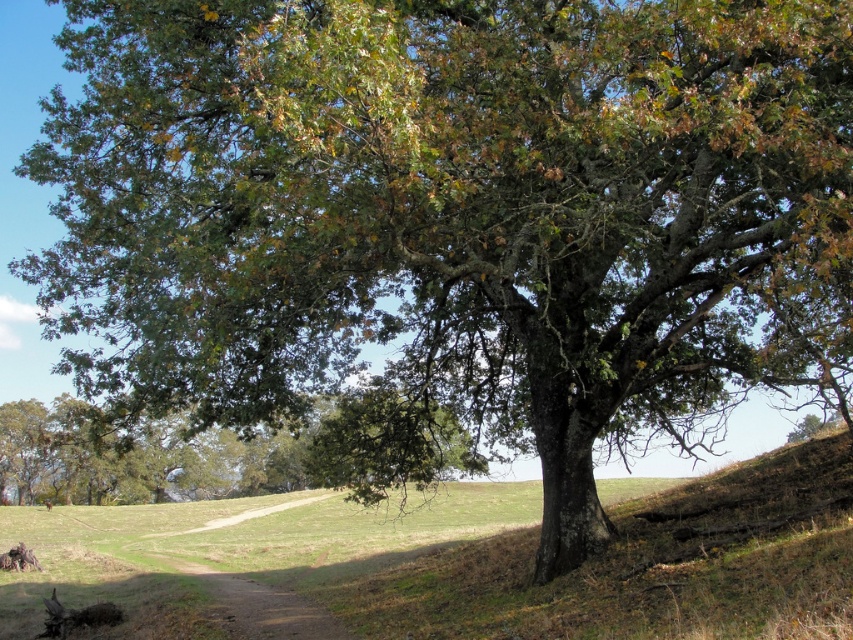
Question: Is green leafy tree at lower left thinner than brown fur dog at lower left?

Choices:
 (A) no
 (B) yes

Answer: (A)

Question: Which point appears closest to the camera in this image?

Choices:
 (A) (218, 444)
 (B) (24, 552)

Answer: (B)

Question: Where is green leafy tree at lower left located in relation to brown fur dog at lower left in the image?

Choices:
 (A) left
 (B) right

Answer: (B)

Question: Which point is closer to the camera taking this photo?

Choices:
 (A) (0, 561)
 (B) (42, 492)

Answer: (A)

Question: Can you confirm if green leafy tree at lower left is positioned below brown fur dog at lower left?

Choices:
 (A) yes
 (B) no

Answer: (B)